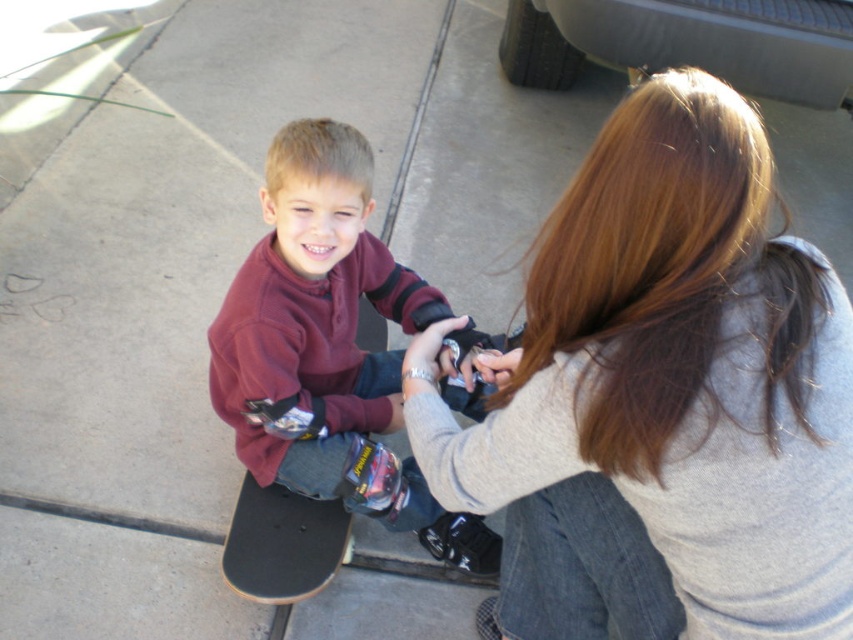
Question: Which point appears farthest from the camera in this image?

Choices:
 (A) (273, 141)
 (B) (335, 508)

Answer: (B)

Question: Which of the following is the farthest from the observer?

Choices:
 (A) smooth concrete skateboard at center
 (B) smooth gray sweater at center
 (C) maroon fleece shirt at center
 (D) black smooth skateboard at center

Answer: (A)

Question: Is smooth gray sweater at center positioned at the back of black smooth skateboard at center?

Choices:
 (A) no
 (B) yes

Answer: (A)

Question: Can you confirm if smooth gray sweater at center is positioned to the left of black smooth skateboard at center?

Choices:
 (A) yes
 (B) no

Answer: (B)

Question: Is maroon fleece shirt at center closer to the viewer compared to black smooth skateboard at center?

Choices:
 (A) no
 (B) yes

Answer: (B)

Question: Which point appears farthest from the camera in this image?

Choices:
 (A) (184, 465)
 (B) (351, 250)
 (C) (822, 577)
 (D) (224, 570)

Answer: (A)